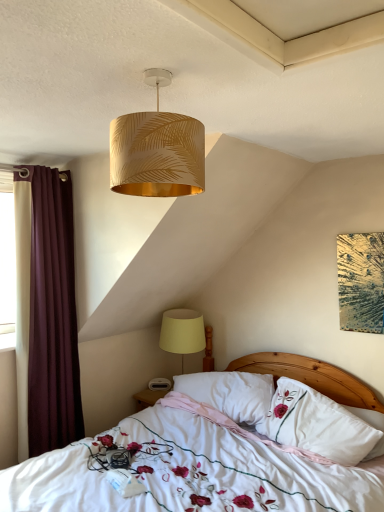
Locate an element on the screen. The image size is (384, 512). vacant area on top of gold leaf-patterned lampshade at upper center, acting as the second lamp starting from the back (from a real-world perspective) is located at coordinates (155, 74).